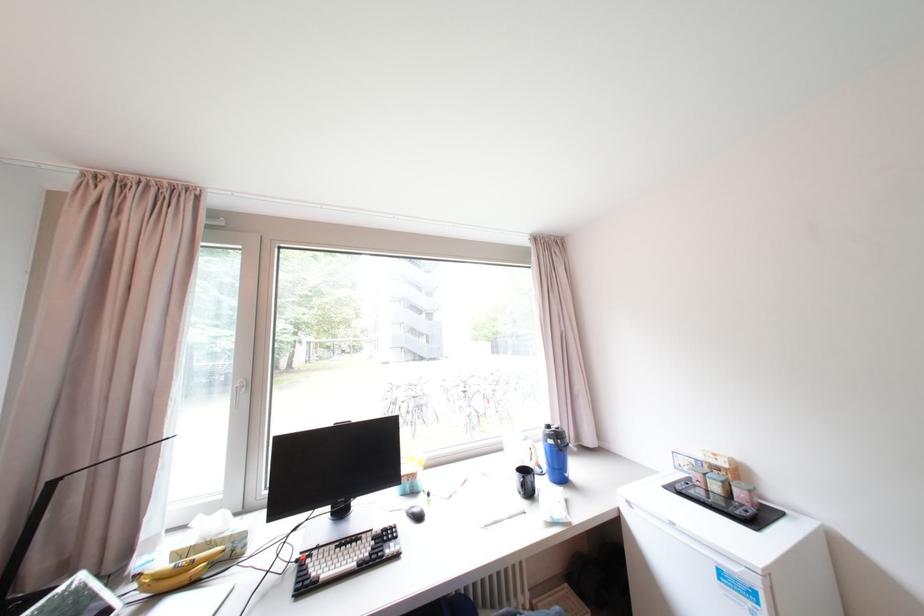
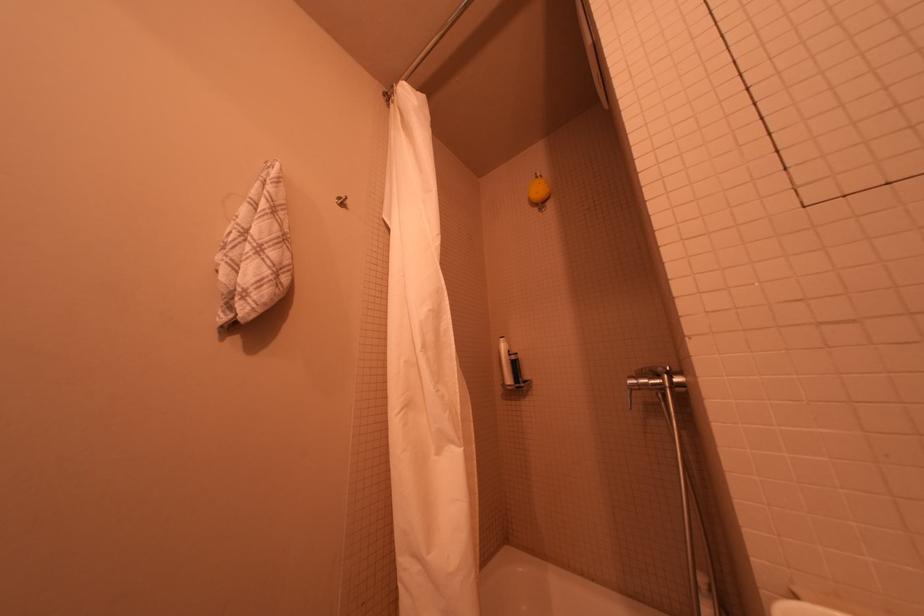
Which direction would the cameraman need to move to produce the second image?

The movement direction of the cameraman is right, backward.